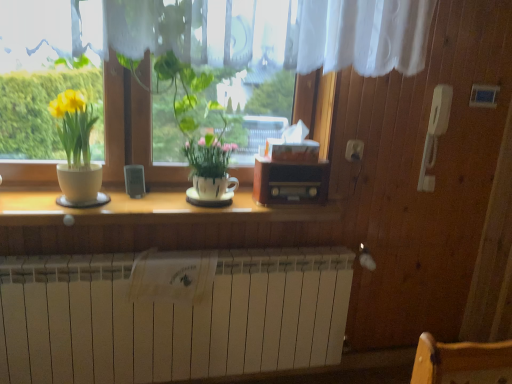
Where is `free space above wooden radio at center (from a real-world perspective)`? free space above wooden radio at center (from a real-world perspective) is located at coordinates (293, 159).